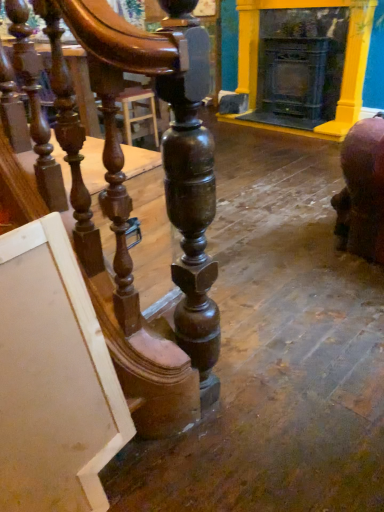
Question: Is polished wood table at left to the left or to the right of matte black fireplace at upper right in the image?

Choices:
 (A) left
 (B) right

Answer: (A)

Question: In terms of width, does polished wood table at left look wider or thinner when compared to matte black fireplace at upper right?

Choices:
 (A) wide
 (B) thin

Answer: (A)

Question: From a real-world perspective, is polished wood table at left positioned above or below matte black fireplace at upper right?

Choices:
 (A) below
 (B) above

Answer: (A)

Question: Looking at their shapes, would you say matte black fireplace at upper right is wider or thinner than polished wood table at left?

Choices:
 (A) wide
 (B) thin

Answer: (B)

Question: Is point (254, 84) positioned closer to the camera than point (145, 210)?

Choices:
 (A) closer
 (B) farther

Answer: (B)

Question: From a real-world perspective, is matte black fireplace at upper right above or below polished wood table at left?

Choices:
 (A) below
 (B) above

Answer: (B)

Question: Is matte black fireplace at upper right in front of or behind polished wood table at left in the image?

Choices:
 (A) front
 (B) behind

Answer: (B)